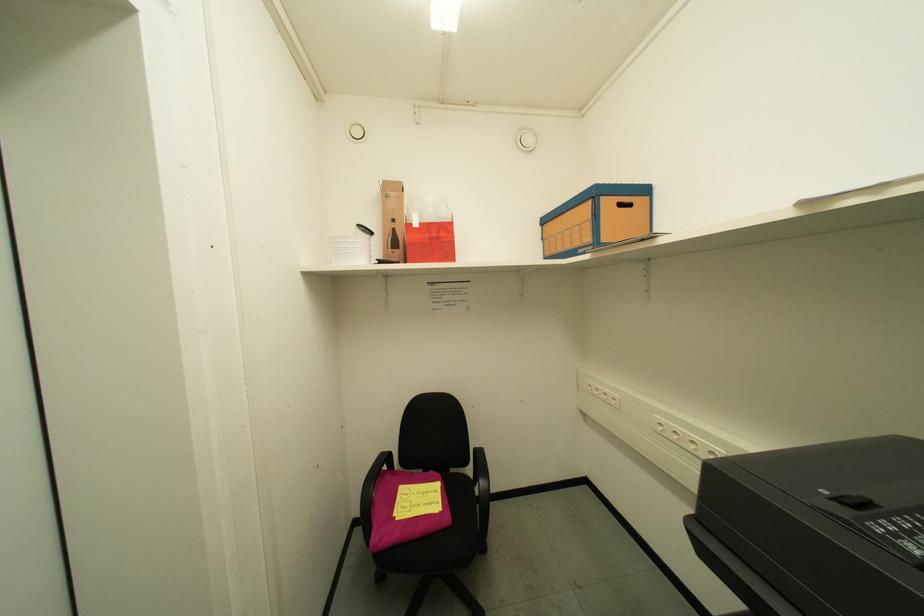
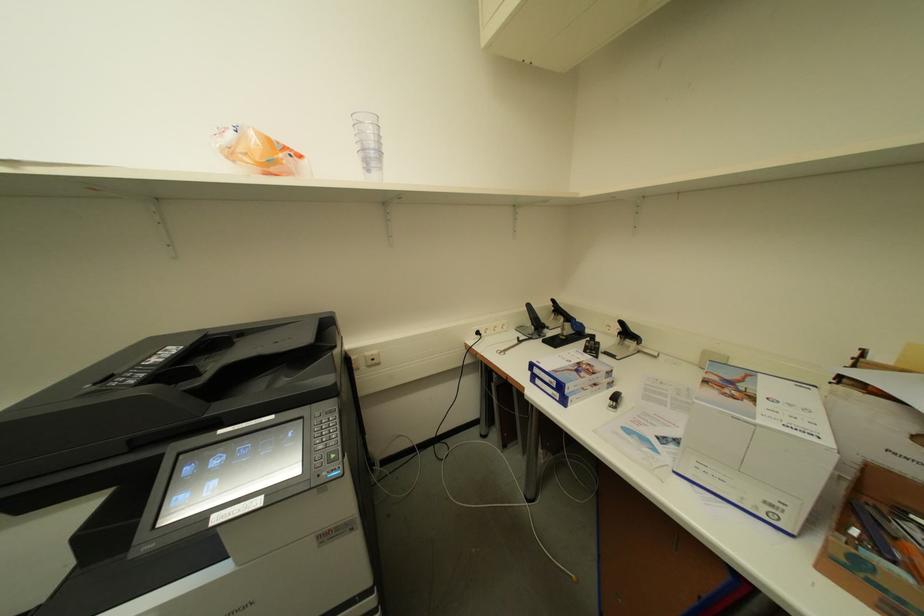
First-person continuous shooting, in which direction is the camera rotating?

The camera's rotation is toward right-down.